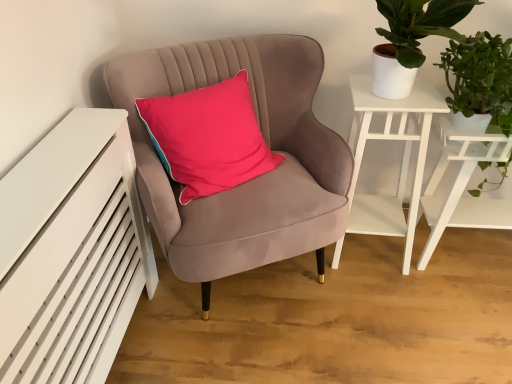
I want to click on free location in front of white matte side table at upper right, so click(x=387, y=302).